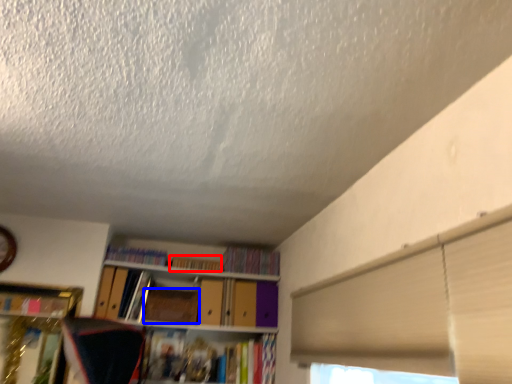
Question: Which object is further to the camera taking this photo, book (highlighted by a red box) or paperback book (highlighted by a blue box)?

Choices:
 (A) book
 (B) paperback book

Answer: (A)